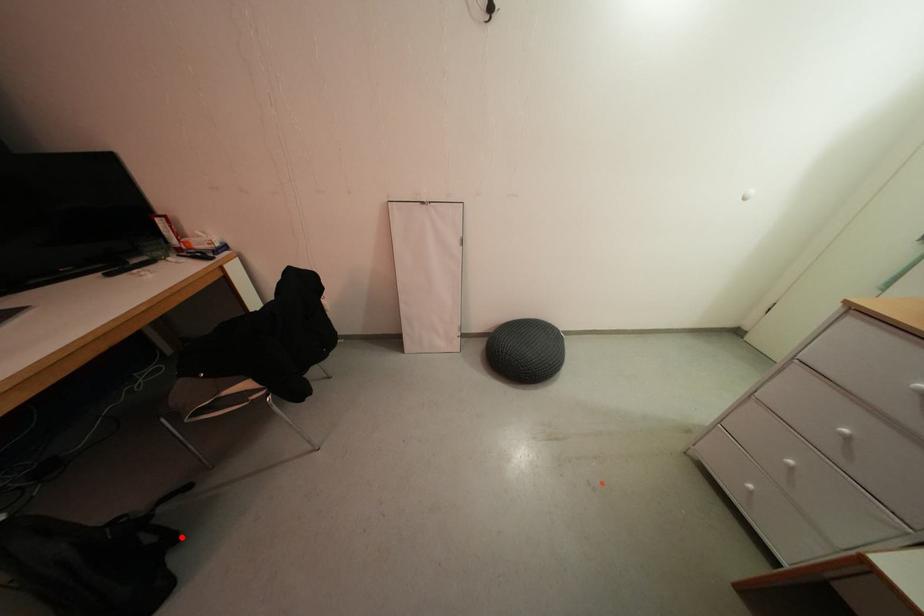
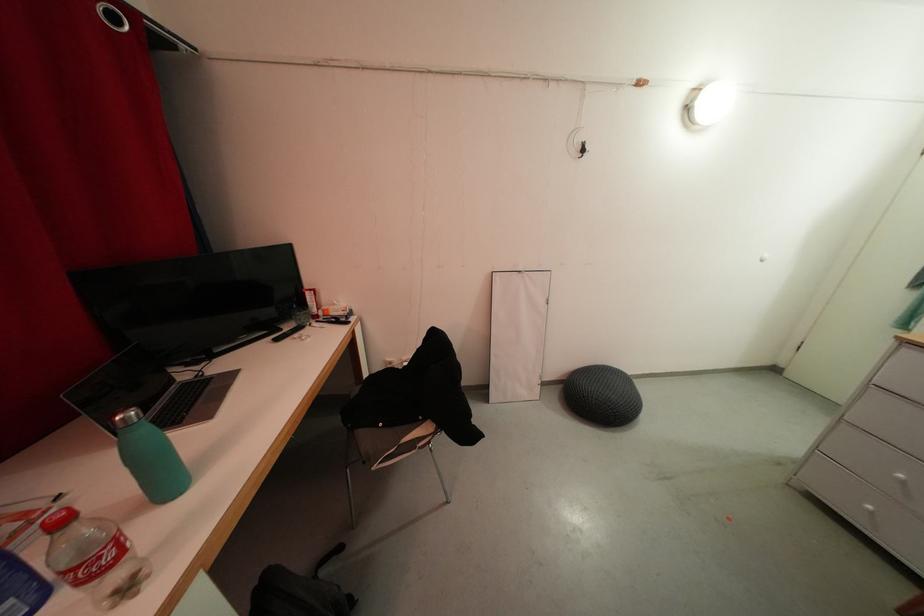
In the second image, find the point that corresponds to the highlighted location in the first image.

(357, 601)